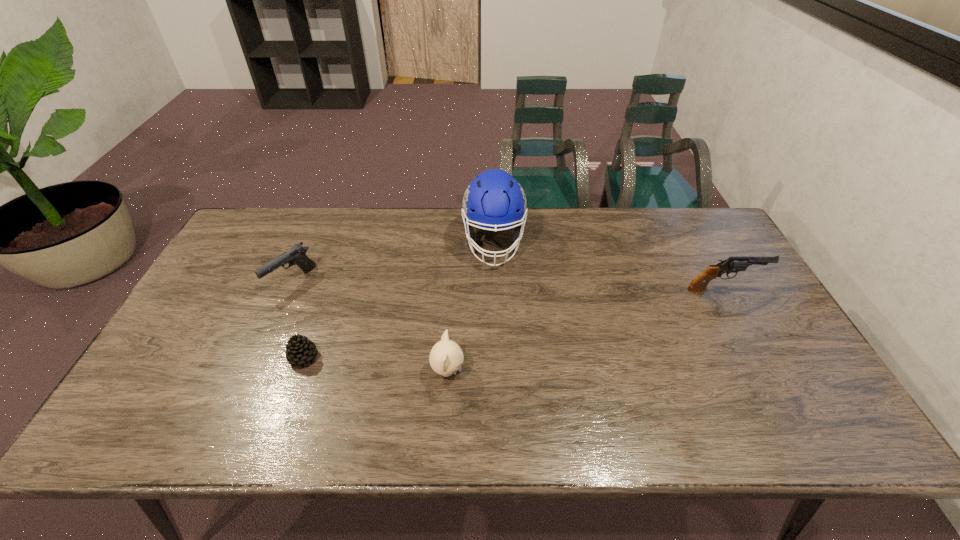
Identify the location of object that is the fourth closest one to the fourth shortest object. (296, 255).

I want to click on vacant position in the image that satisfies the following two spatial constraints: 1. along the barrel of the right gun; 2. at the narrow end of the shortest object, so click(761, 357).

Locate an element on the screen. The height and width of the screenshot is (540, 960). free location that satisfies the following two spatial constraints: 1. on the face guard of the tallest object; 2. on the face of the kitten is located at coordinates (498, 371).